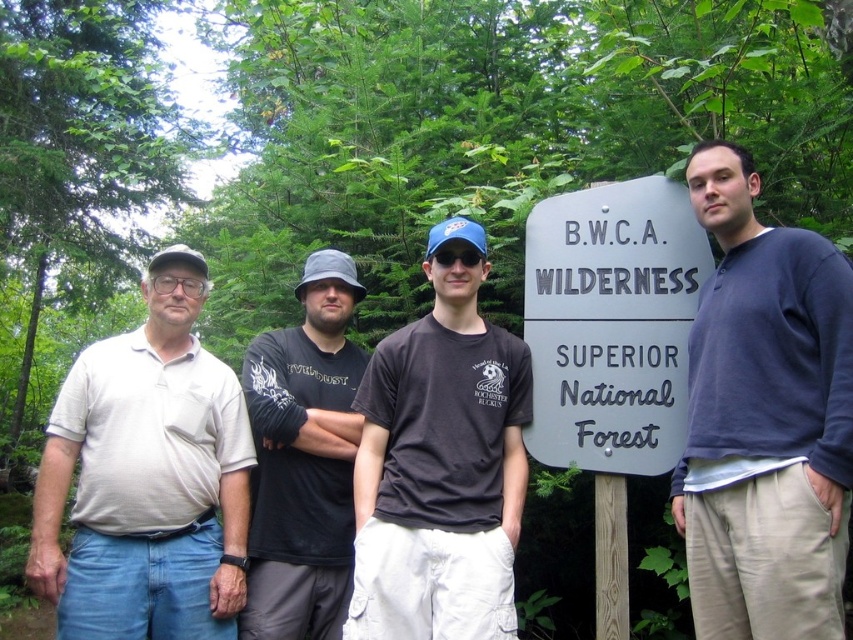
Question: Is dark blue sweater at center above black matte shirt at center?

Choices:
 (A) no
 (B) yes

Answer: (B)

Question: Which object appears closest to the camera in this image?

Choices:
 (A) dark gray t-shirt at center
 (B) beige cotton polo shirt at left

Answer: (A)

Question: Does dark blue sweater at center appear under gray metal sign at center?

Choices:
 (A) no
 (B) yes

Answer: (B)

Question: Which of these objects is positioned closest to the beige cotton polo shirt at left?

Choices:
 (A) black matte shirt at center
 (B) gray metal sign at center
 (C) dark gray t-shirt at center
 (D) dark blue sweater at center

Answer: (A)

Question: Which of these objects is positioned closest to the dark blue sweater at center?

Choices:
 (A) black matte shirt at center
 (B) beige cotton polo shirt at left

Answer: (A)

Question: Is gray metal sign at center positioned before black matte shirt at center?

Choices:
 (A) no
 (B) yes

Answer: (B)